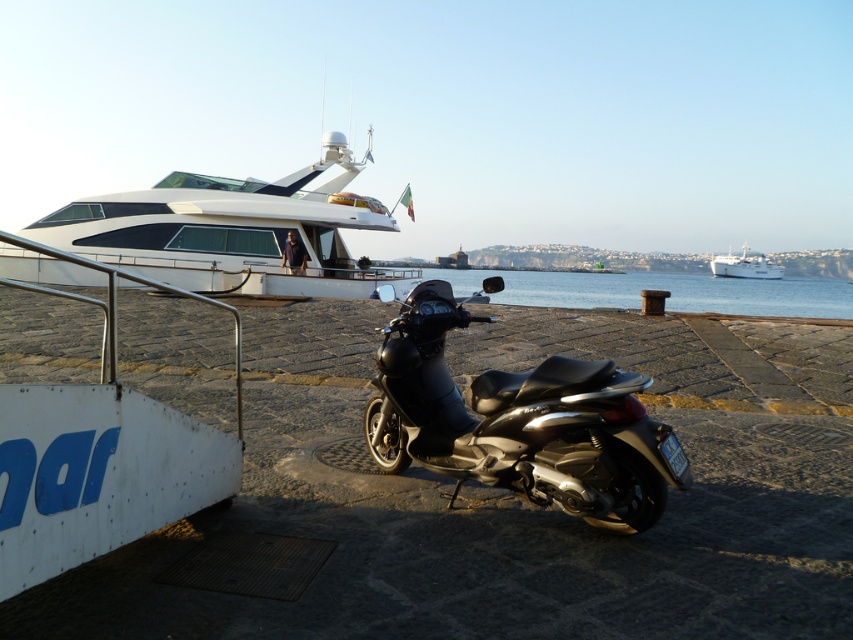
You are planning to take a short tour around the harbor and have to choose between the white glossy yacht at upper left and the white glossy boat at upper right. Based on their sizes, which one would you choose for better comfort and space?

The white glossy yacht at upper left is bigger than the white glossy boat at upper right, so it would provide more comfort and space for the tour.

Based on the photo, you are planning to take a photo of the shiny black scooter at center and the blue water at center. Which object should you focus on first if you want both to be in sharp focus, considering their sizes?

The shiny black scooter at center has a smaller size compared to blue water at center, so you should focus on the shiny black scooter at center first to ensure both are in sharp focus.

You are standing on the dock and want to take a photo of both the white glossy yacht at upper left and the white glossy boat at upper right. Which one will appear larger in the photo?

The white glossy yacht at upper left will appear larger in the photo because it is closer to the viewer than the white glossy boat at upper right.